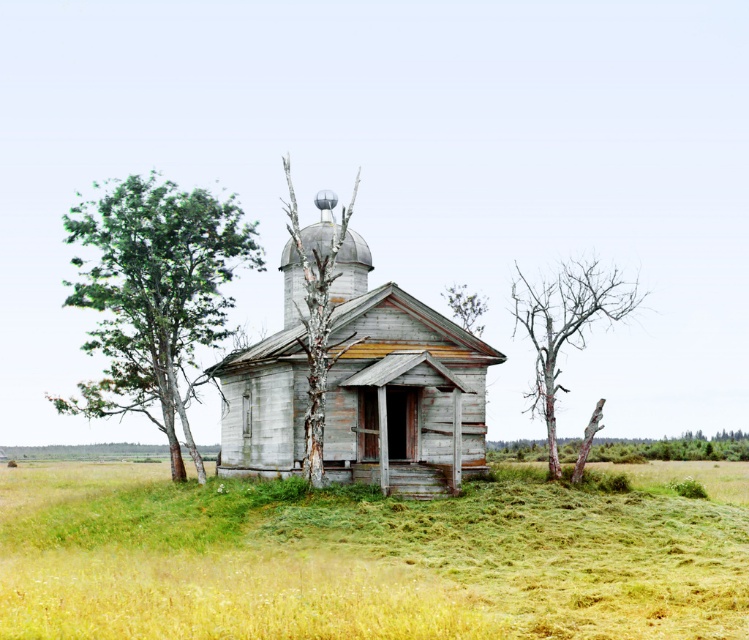
You are planning to host a small outdoor event and need to know if there is enough space around the weathered wood church at center for guests to gather. Based on the scene, can you determine if the green grassy field at center provides sufficient space?

The green grassy field at center is bigger than the weathered wood church at center, so yes, the green grassy field at center provides enough space for guests to gather around the weathered wood church at center.

You are standing in front of the rustic wooden chapel and notice two trees nearby. The green leafy tree at left and the bare wood tree at right. Which tree is taller?

The green leafy tree at left is taller than the bare wood tree at right.